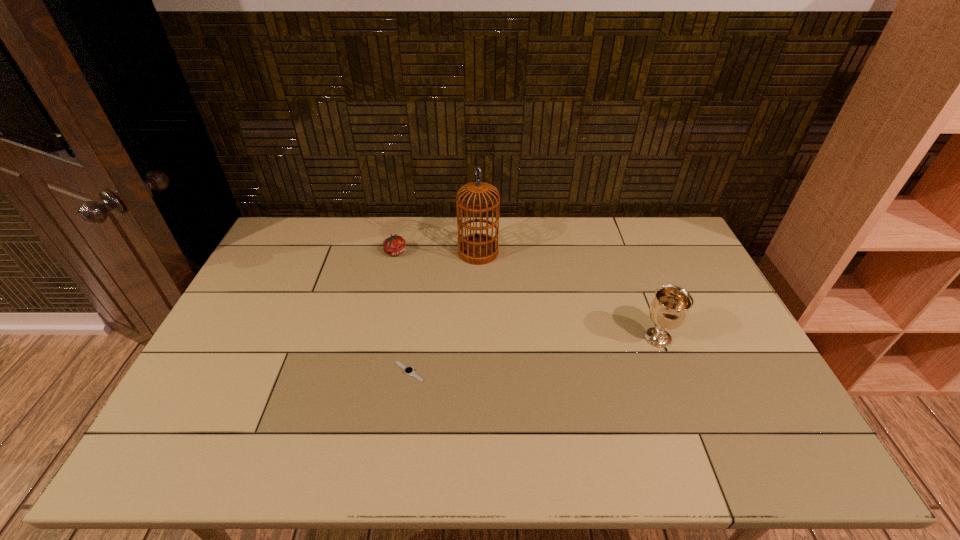
Where is `vacant space located on the right of the leftmost object`? This screenshot has width=960, height=540. vacant space located on the right of the leftmost object is located at coordinates 501,252.

Locate an element on the screen. vacant region located on the left of the shortest object is located at coordinates (277, 372).

The width and height of the screenshot is (960, 540). Find the location of `birdcage at the far edge`. birdcage at the far edge is located at coordinates (477, 249).

Image resolution: width=960 pixels, height=540 pixels. I want to click on tomato that is at the far edge, so click(x=395, y=245).

Find the location of a particular element. The height and width of the screenshot is (540, 960). free region at the far edge of the desktop is located at coordinates (456, 251).

The image size is (960, 540). In the image, there is a desktop. Identify the location of blank space at the near edge. (641, 457).

The image size is (960, 540). In the image, there is a desktop. In order to click on free space at the left edge in this screenshot , I will do `click(254, 289)`.

Where is `vacant space at the right edge of the desktop`? vacant space at the right edge of the desktop is located at coordinates (696, 267).

You are a GUI agent. You are given a task and a screenshot of the screen. Output one action in this format:
    pyautogui.click(x=<x>, y=<y>)
    Task: Click on the free spot at the far left corner of the desktop
    The image size is (960, 540).
    Given the screenshot: What is the action you would take?
    pyautogui.click(x=325, y=219)

Where is `vacant space at the near left corner`? vacant space at the near left corner is located at coordinates (172, 432).